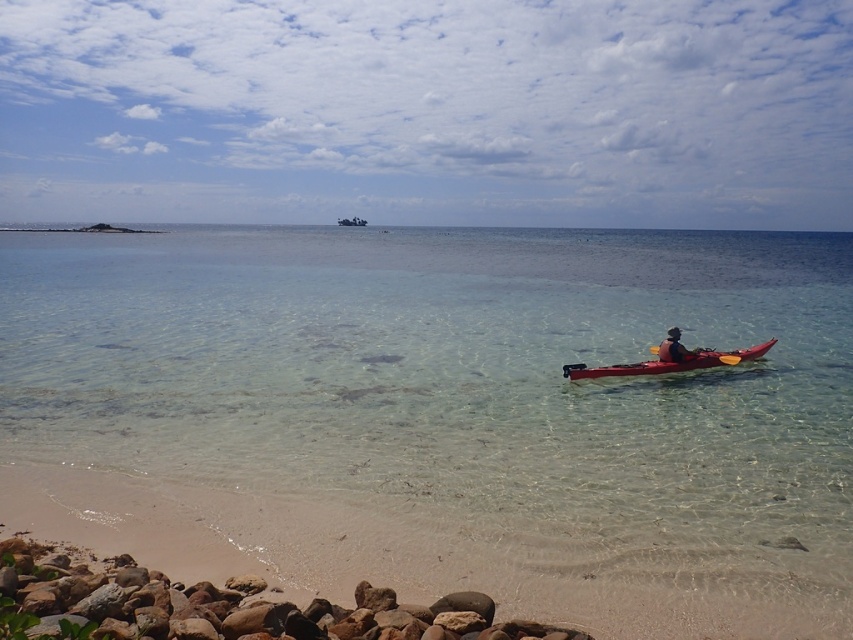
Question: Which point is farther to the camera?

Choices:
 (A) rusty stone rocks at lower left
 (B) matte red kayak at center-right
 (C) matte red kayak at center

Answer: (C)

Question: Is clear glassy water at center to the right of rusty stone rocks at lower left from the viewer's perspective?

Choices:
 (A) yes
 (B) no

Answer: (A)

Question: Which point appears farthest from the camera in this image?

Choices:
 (A) (660, 365)
 (B) (7, 608)
 (C) (354, 225)

Answer: (C)

Question: Does clear glassy water at center appear on the left side of matte red kayak at center-right?

Choices:
 (A) no
 (B) yes

Answer: (B)

Question: Is matte black kayak at center-right positioned in front of matte red kayak at center?

Choices:
 (A) yes
 (B) no

Answer: (A)

Question: Estimate the real-world distances between objects in this image. Which object is farther from the clear glassy water at center?

Choices:
 (A) matte black kayak at center-right
 (B) matte red kayak at center-right
 (C) rusty stone rocks at lower left
 (D) matte red kayak at center

Answer: (D)